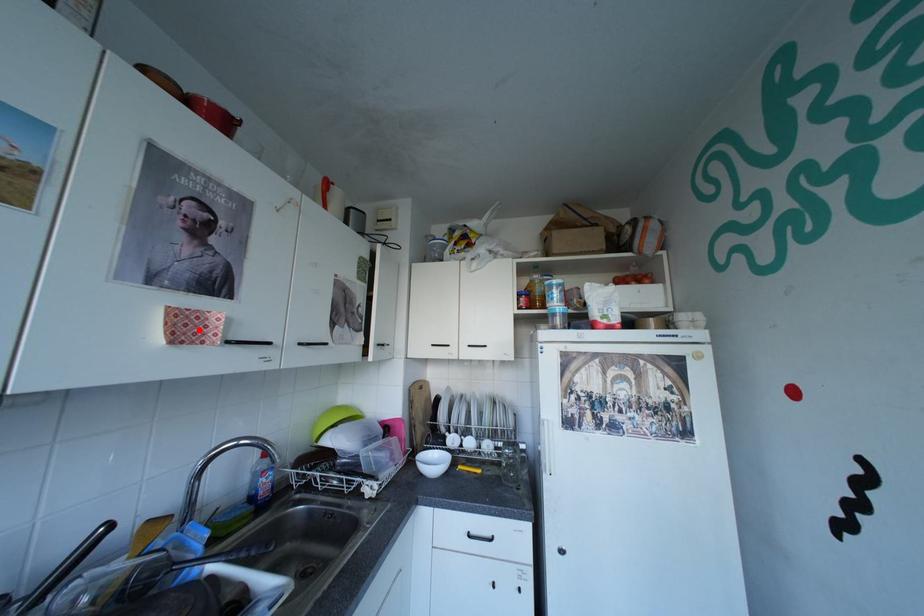
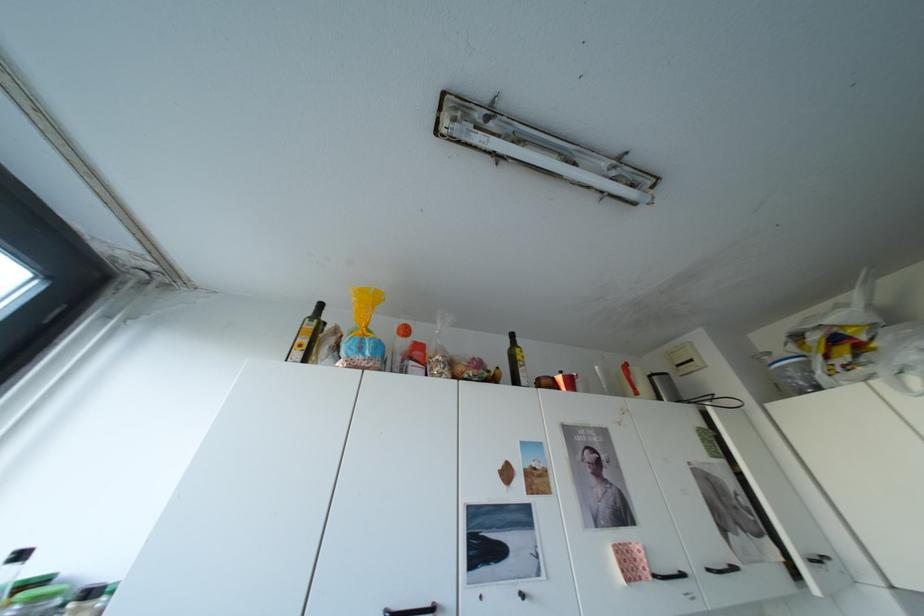
Where in the second image is the point corresponding to the highlighted location from the first image?

(642, 568)